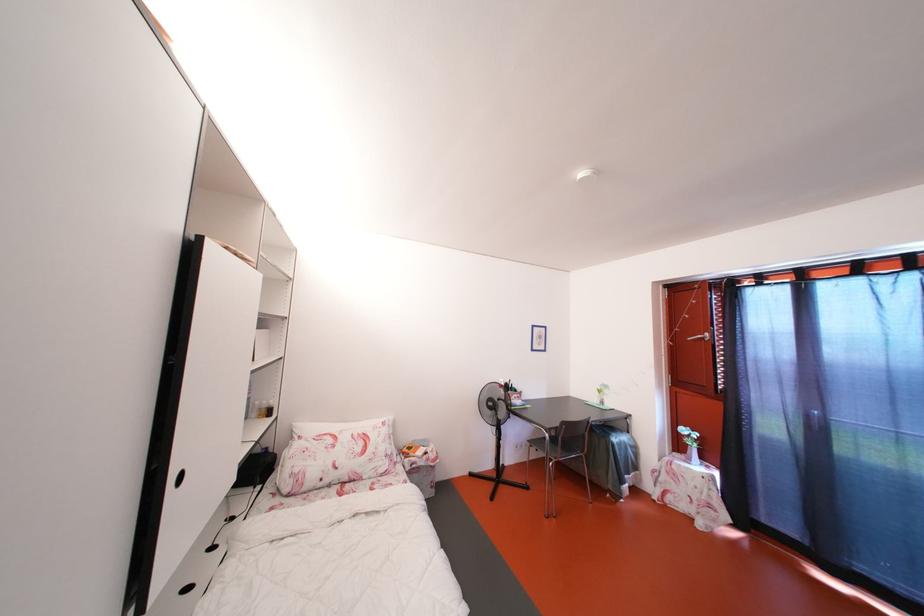
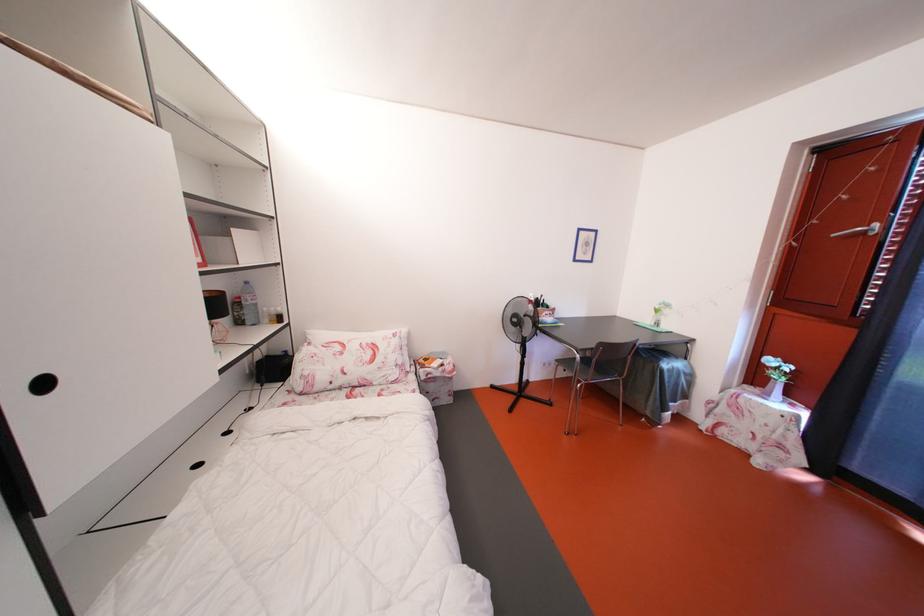
In a continuous first-person perspective shot, in which direction is the camera moving?

The cameraman moved toward right, forward.